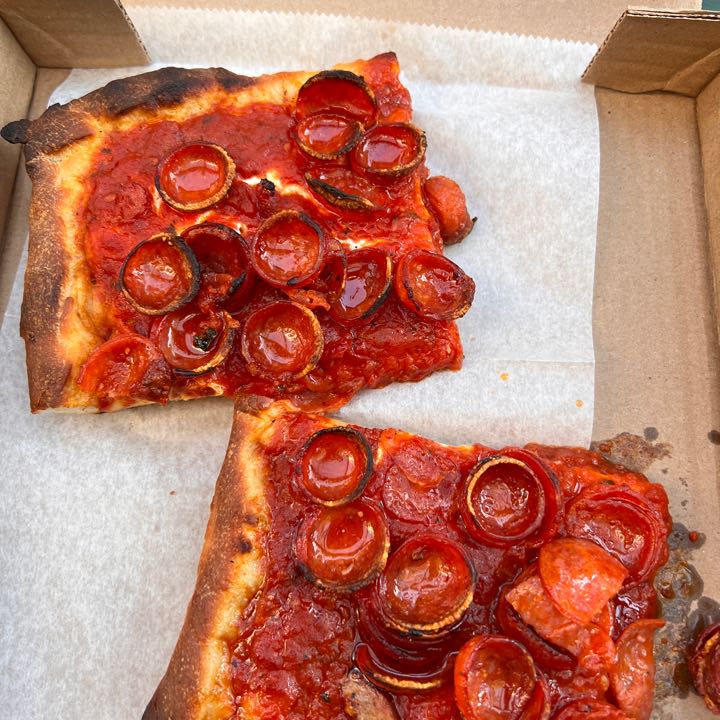
Where is `box`? box is located at coordinates (584, 219).